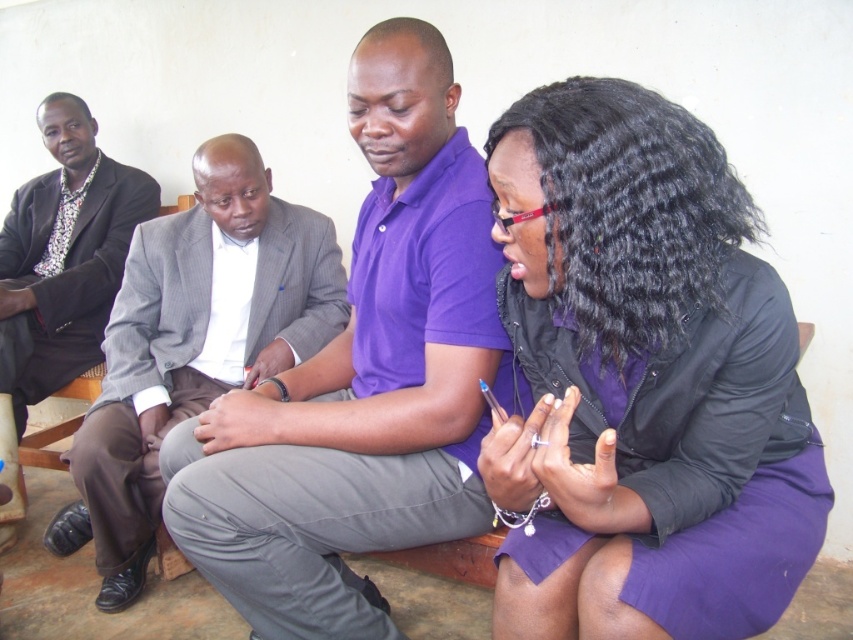
You are standing in the room and want to move from the point at coordinates [323,429] to the point at coordinates [248,348]. Which direction should you move in to get there?

To move from point [323,429] to point [248,348], you should move backward since point [323,429] is in front of point [248,348].

You are standing in the room and want to hand a document to the person wearing the purple cotton polo shirt at center. Based on their position relative to the others, where should you approach from?

The purple cotton polo shirt at center is located at point (360, 380), which places them centrally in the room. Approach from the front to ensure they can easily receive the document without obstructing the others.

You are standing in the room and want to move from point (756, 483) to point (222, 216). Which direction should you move to get closer to the wall?

Since point (756, 483) is closer to the viewer than point (222, 216), you should move towards the wall by going in the direction of point (222, 216) to get closer to the wall.